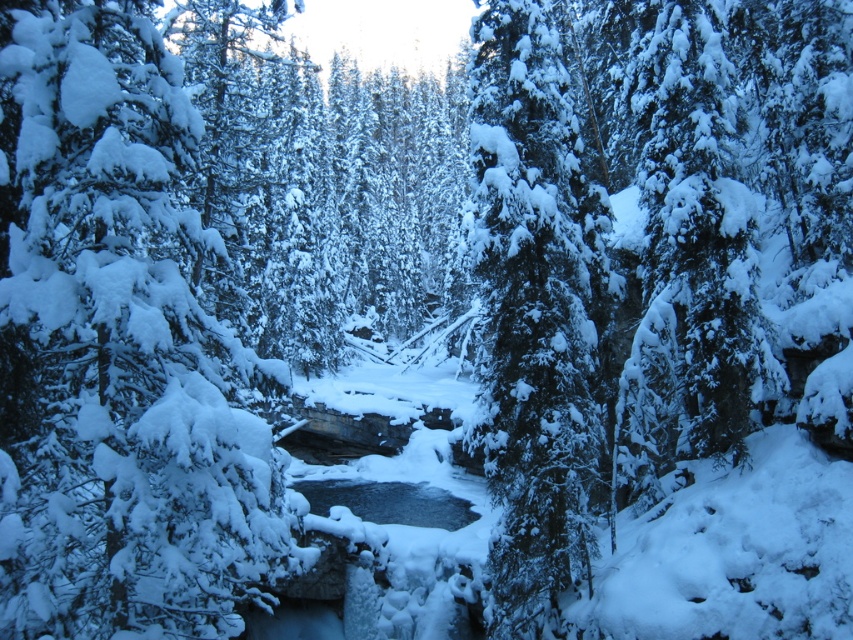
Can you confirm if snow-covered evergreen at left is positioned to the left of green textured pine at center?

Yes, snow-covered evergreen at left is to the left of green textured pine at center.

Measure the distance between snow-covered evergreen at left and green textured pine at center.

A distance of 7.01 meters exists between snow-covered evergreen at left and green textured pine at center.

Is point (164, 164) less distant than point (509, 433)?

Yes, it is.

Find the location of a particular element. The height and width of the screenshot is (640, 853). snow-covered evergreen at left is located at coordinates (117, 349).